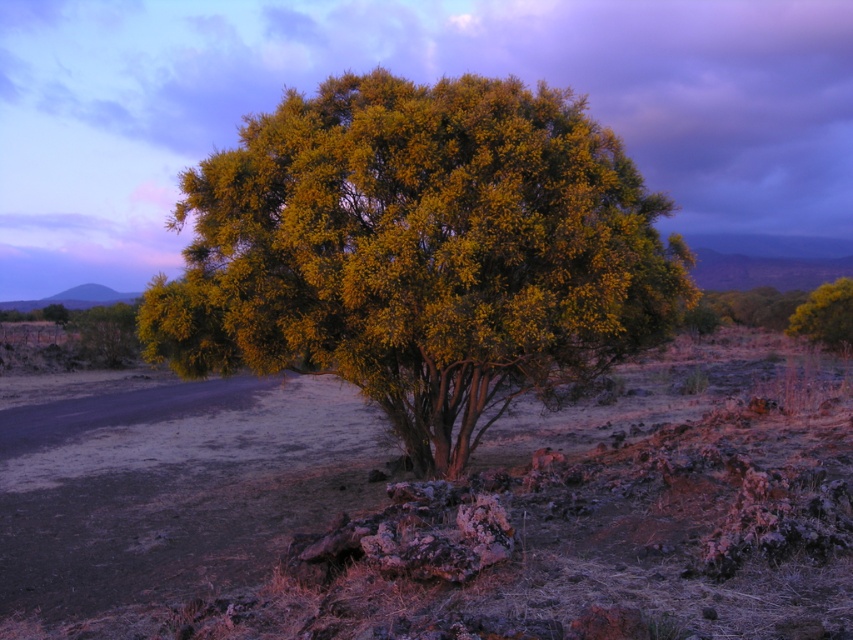
You are standing at the center of the image and want to place a small marker exactly at the coordinates given for the dull brown dirt at center. What are the coordinates where you should place the marker?

The coordinates for the dull brown dirt at center are point [436,506], so you should place the marker there.

You are standing at the base of the solitary tree in the dry landscape. If you walk directly towards the point labeled as point (436,506), what will you encounter first?

The point (436,506) corresponds to dull brown dirt at center, so you will encounter the dull brown dirt at center first.